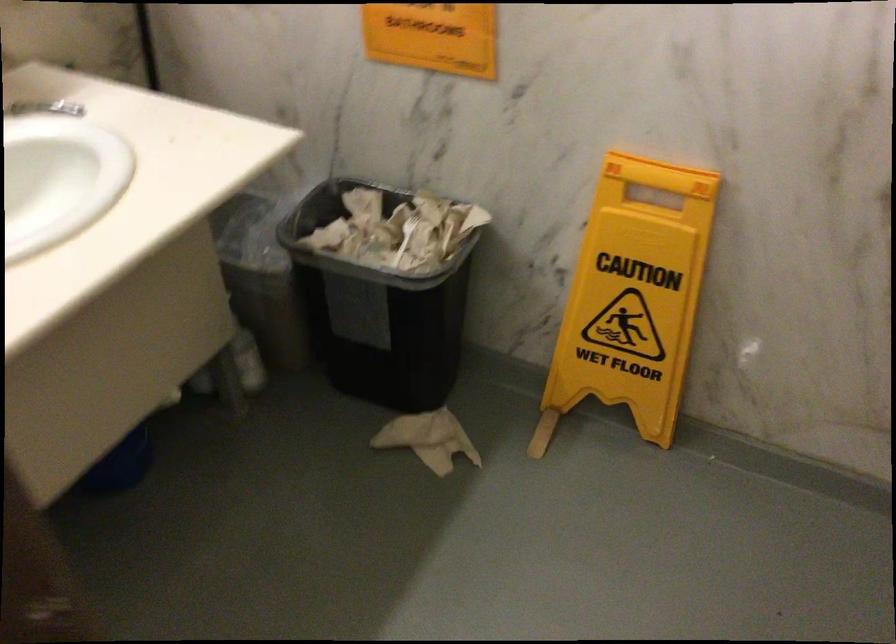
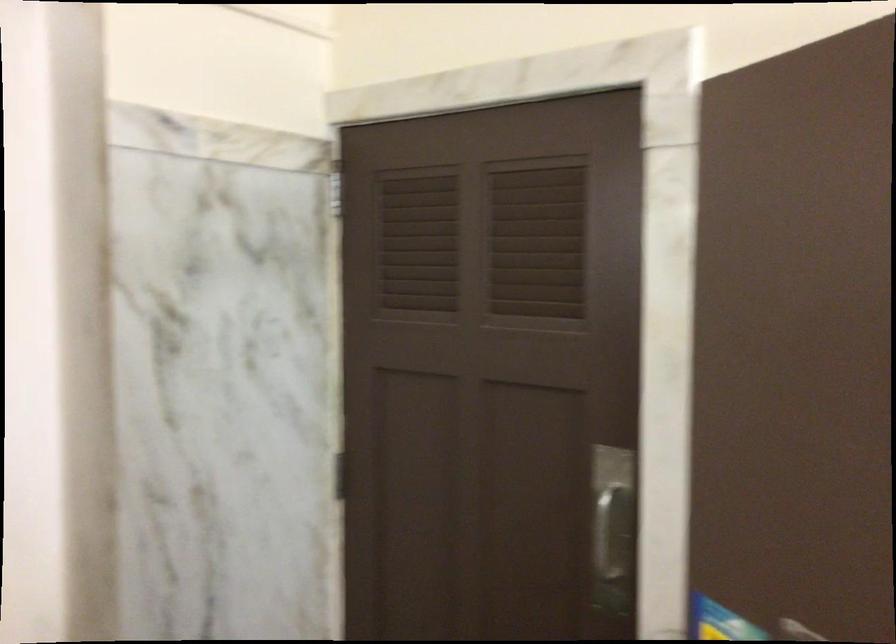
Question: The images are taken continuously from a first-person perspective. In which direction is your viewpoint rotating?

Choices:
 (A) Left
 (B) Right
 (C) Up
 (D) Down

Answer: (B)